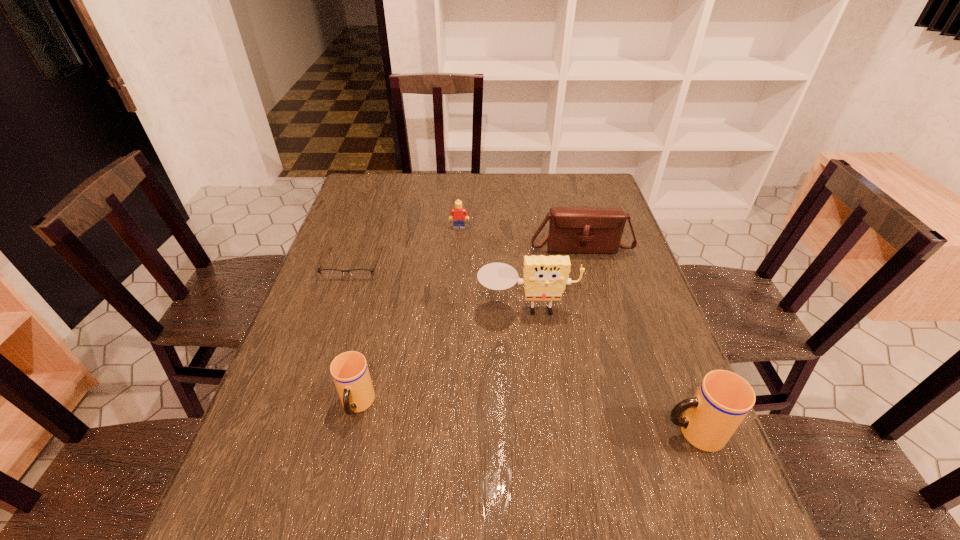
Please point a spot to place another cup for symmetrical spacing. Please provide its 2D coordinates. Your answer should be formatted as a tuple, i.e. [(x, y)], where the tuple contains the x and y coordinates of a point satisfying the conditions above.

[(521, 418)]